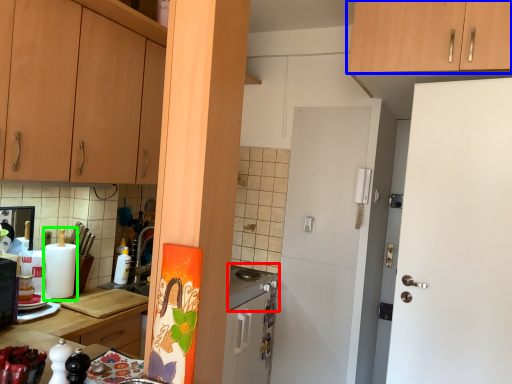
Question: Estimate the real-world distances between objects in this image. Which object is closer to gas stove (highlighted by a red box), cabinetry (highlighted by a blue box) or appliance (highlighted by a green box)?

Choices:
 (A) cabinetry
 (B) appliance

Answer: (B)